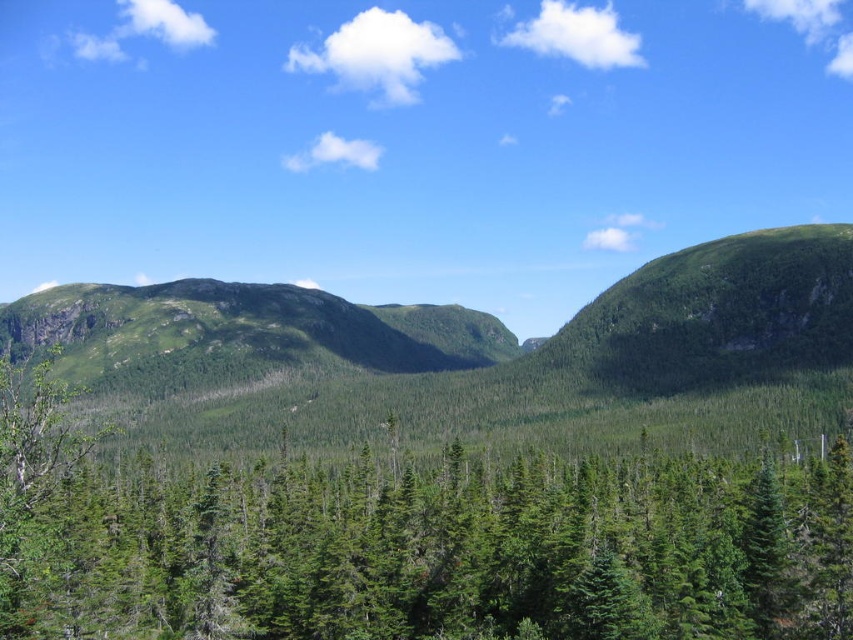
You are standing at the camera position observing the landscape. There are two points marked in the image, point (9, 602) and point (456, 372). Which point is nearer to you?

Point (9, 602) is closer to the camera than point (456, 372), so the point nearer to you is point (9, 602).

You are standing in the forest and want to reach the green grassy mountain at center. Which direction should you move relative to the green matte tree at center?

You should move away from the green matte tree at center because the green grassy mountain at center is further away from the viewer than the green matte tree at center.

You are a hiker planning to take a photo of the green matte tree at center and the green grassy mountain at center. Which object should you stand closer to in order to capture both in a single frame without zooming?

You should stand closer to the green matte tree at center because it is smaller than the green grassy mountain at center, allowing both to fit within the frame when positioned nearer to the smaller object.